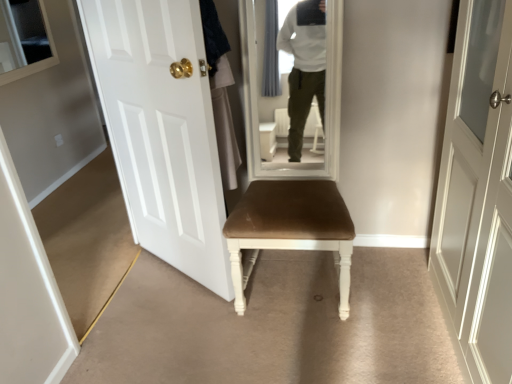
Question: Is brown velvet chair at center to the right of white glossy door at left from the viewer's perspective?

Choices:
 (A) yes
 (B) no

Answer: (A)

Question: From a real-world perspective, is brown velvet chair at center beneath white glossy door at left?

Choices:
 (A) yes
 (B) no

Answer: (A)

Question: Is brown velvet chair at center surrounding white glossy door at left?

Choices:
 (A) no
 (B) yes

Answer: (A)

Question: Considering the relative sizes of brown velvet chair at center and white glossy door at left in the image provided, is brown velvet chair at center taller than white glossy door at left?

Choices:
 (A) yes
 (B) no

Answer: (B)

Question: Is brown velvet chair at center positioned before white glossy door at left?

Choices:
 (A) yes
 (B) no

Answer: (B)

Question: From the image's perspective, is brown velvet chair at center beneath white glossy door at left?

Choices:
 (A) no
 (B) yes

Answer: (B)

Question: Is white glossy door at left wider than brown velvet chair at center?

Choices:
 (A) yes
 (B) no

Answer: (B)

Question: From a real-world perspective, is white glossy door at left positioned under brown velvet chair at center based on gravity?

Choices:
 (A) no
 (B) yes

Answer: (A)

Question: Is white glossy door at left thinner than brown velvet chair at center?

Choices:
 (A) no
 (B) yes

Answer: (B)

Question: From the image's perspective, is white glossy door at left located above brown velvet chair at center?

Choices:
 (A) no
 (B) yes

Answer: (B)

Question: Is white glossy door at left directly adjacent to brown velvet chair at center?

Choices:
 (A) yes
 (B) no

Answer: (B)

Question: Does white glossy door at left have a greater height compared to brown velvet chair at center?

Choices:
 (A) no
 (B) yes

Answer: (B)

Question: Does point (348, 301) appear closer or farther from the camera than point (110, 117)?

Choices:
 (A) farther
 (B) closer

Answer: (B)